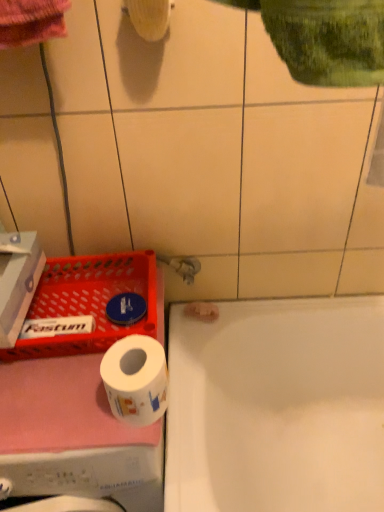
Image resolution: width=384 pixels, height=512 pixels. What do you see at coordinates (136, 379) in the screenshot?
I see `white matte toilet paper at lower left` at bounding box center [136, 379].

Describe the element at coordinates (277, 407) in the screenshot. I see `white glossy bathtub at lower right` at that location.

At what (x,y) coordinates should I click in order to perform the action: click on white matte toilet paper at lower left. Please return your answer as a coordinate pair (x, y). Looking at the image, I should click on (136, 379).

From the image's perspective, is white glossy washing machine at lower left positioned above or below white cardboard box at left?

white glossy washing machine at lower left is below white cardboard box at left.

Is white glossy washing machine at lower left bigger than white cardboard box at left?

Yes, white glossy washing machine at lower left is bigger than white cardboard box at left.

Is white cardboard box at left inside white glossy washing machine at lower left?

Definitely not — white cardboard box at left is not inside white glossy washing machine at lower left.

Locate an element on the screen. laundry basket on the left of white matte toilet paper at lower left is located at coordinates (89, 302).

Is red plastic tray at lower left in contact with white matte toilet paper at lower left?

There is a gap between red plastic tray at lower left and white matte toilet paper at lower left.

Based on the photo, is white matte toilet paper at lower left at the back of red plastic tray at lower left?

No, red plastic tray at lower left's orientation is not away from white matte toilet paper at lower left.

Does red plastic tray at lower left have a larger size compared to white matte toilet paper at lower left?

Correct, red plastic tray at lower left is larger in size than white matte toilet paper at lower left.

Which of these two, white glossy washing machine at lower left or red plastic tray at lower left, stands shorter?

With less height is red plastic tray at lower left.

Can you see white glossy washing machine at lower left touching red plastic tray at lower left?

No, white glossy washing machine at lower left is not making contact with red plastic tray at lower left.

Would you say white glossy washing machine at lower left is to the left or to the right of red plastic tray at lower left in the picture?

white glossy washing machine at lower left is to the left of red plastic tray at lower left.

Considering the positions of objects white glossy bathtub at lower right and white glossy washing machine at lower left in the image provided, who is behind, white glossy bathtub at lower right or white glossy washing machine at lower left?

white glossy bathtub at lower right is behind.

Is white glossy bathtub at lower right outside of white glossy washing machine at lower left?

Indeed, white glossy bathtub at lower right is completely outside white glossy washing machine at lower left.

Which is in front, point (310, 482) or point (43, 439)?

Point (43, 439)

From the picture: From a real-world perspective, who is located lower, white glossy bathtub at lower right or white glossy washing machine at lower left?

white glossy bathtub at lower right.

Would you say white glossy washing machine at lower left is inside or outside white matte toilet paper at lower left?

white glossy washing machine at lower left exists outside the volume of white matte toilet paper at lower left.

Is white glossy washing machine at lower left beside white matte toilet paper at lower left?

No, white glossy washing machine at lower left is not touching white matte toilet paper at lower left.

From the image's perspective, does white glossy washing machine at lower left appear higher than white matte toilet paper at lower left?

No, from the image's perspective, white glossy washing machine at lower left is not over white matte toilet paper at lower left.

From the picture: Can you tell me how much white glossy washing machine at lower left and white glossy bathtub at lower right differ in facing direction?

There is a 0.000152-degree angle between the facing directions of white glossy washing machine at lower left and white glossy bathtub at lower right.

Are white glossy washing machine at lower left and white glossy bathtub at lower right beside each other?

No, white glossy washing machine at lower left is not next to white glossy bathtub at lower right.

Who is smaller, white glossy washing machine at lower left or white glossy bathtub at lower right?

With smaller size is white glossy bathtub at lower right.

From a real-world perspective, who is located lower, white glossy washing machine at lower left or white glossy bathtub at lower right?

From a 3D spatial view, white glossy bathtub at lower right is below.

Does point (24, 267) appear closer or farther from the camera than point (178, 329)?

Point (24, 267) appears to be closer to the viewer than point (178, 329).

Considering the sizes of white cardboard box at left and white glossy bathtub at lower right in the image, is white cardboard box at left wider or thinner than white glossy bathtub at lower right?

Clearly, white cardboard box at left has less width compared to white glossy bathtub at lower right.

Is white cardboard box at left positioned behind white glossy bathtub at lower right?

No, white cardboard box at left is in front of white glossy bathtub at lower right.

Where is `carton that appears above the white glossy washing machine at lower left (from the image's perspective)`? Image resolution: width=384 pixels, height=512 pixels. carton that appears above the white glossy washing machine at lower left (from the image's perspective) is located at coordinates (17, 281).

Identify the location of toilet paper located below the red plastic tray at lower left (from the image's perspective). (136, 379).

When comparing their distances from red plastic tray at lower left, does white matte toilet paper at lower left or white glossy washing machine at lower left seem closer?

Based on the image, white glossy washing machine at lower left appears to be nearer to red plastic tray at lower left.

When comparing their distances from white matte toilet paper at lower left, does white glossy bathtub at lower right or red plastic tray at lower left seem closer?

Among the two, red plastic tray at lower left is located nearer to white matte toilet paper at lower left.

Looking at the image, which one is located closer to white matte toilet paper at lower left, white glossy bathtub at lower right or white glossy washing machine at lower left?

white glossy washing machine at lower left lies closer to white matte toilet paper at lower left than the other object.

Considering their positions, is white cardboard box at left positioned further to red plastic tray at lower left than white glossy bathtub at lower right?

The object further to red plastic tray at lower left is white glossy bathtub at lower right.

Which object lies further to the anchor point white cardboard box at left, red plastic tray at lower left or white glossy washing machine at lower left?

white glossy washing machine at lower left is positioned further to the anchor white cardboard box at left.

When comparing their distances from white glossy bathtub at lower right, does white cardboard box at left or white matte toilet paper at lower left seem further?

The object further to white glossy bathtub at lower right is white cardboard box at left.

When comparing their distances from white matte toilet paper at lower left, does white glossy washing machine at lower left or white cardboard box at left seem further?

white cardboard box at left lies further to white matte toilet paper at lower left than the other object.

From the image, which object appears to be farther from white cardboard box at left, white glossy washing machine at lower left or white glossy bathtub at lower right?

white glossy bathtub at lower right is further to white cardboard box at left.

Locate an element on the screen. The image size is (384, 512). toilet paper between white cardboard box at left and white glossy bathtub at lower right from left to right is located at coordinates (136, 379).

At what (x,y) coordinates should I click in order to perform the action: click on washing machine situated between white cardboard box at left and white glossy bathtub at lower right from left to right. Please return your answer as a coordinate pair (x, y). Image resolution: width=384 pixels, height=512 pixels. Looking at the image, I should click on (73, 436).

Identify the location of toilet paper located between red plastic tray at lower left and white glossy bathtub at lower right in the left-right direction. (136, 379).

The image size is (384, 512). What are the coordinates of `laundry basket between white cardboard box at left and white glossy bathtub at lower right in the horizontal direction` in the screenshot? It's located at (89, 302).